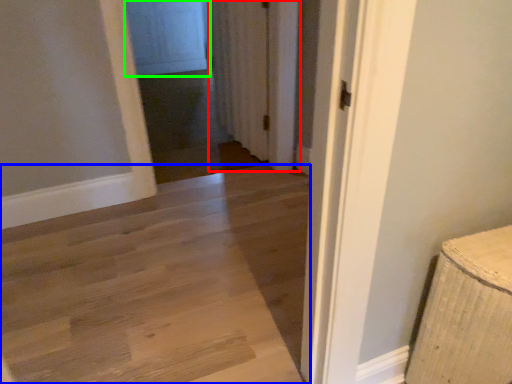
Question: Which object is positioned farthest from curtain (highlighted by a red box)? Select from path (highlighted by a blue box) and screen door (highlighted by a green box).

Choices:
 (A) path
 (B) screen door

Answer: (B)